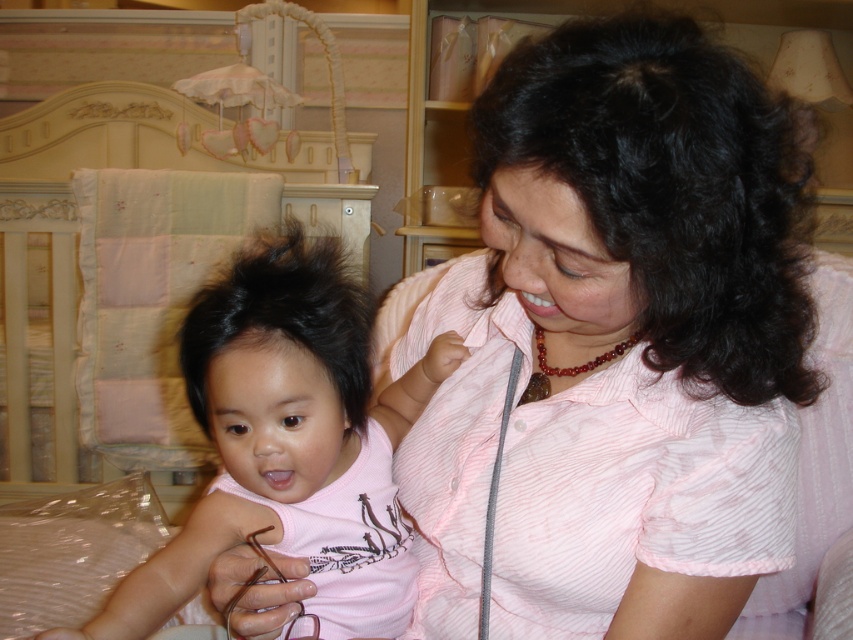
From the picture: Where is the pink striped shirt at center located in the image?

The pink striped shirt at center is located at point 0.537 on the x axis and 0.728 on the y axis.